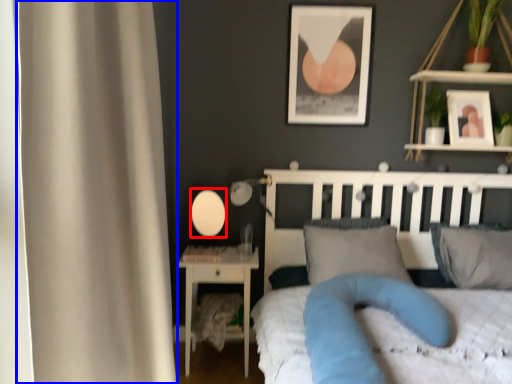
Question: Which point is closer to the camera, oval (highlighted by a red box) or curtain (highlighted by a blue box)?

Choices:
 (A) oval
 (B) curtain

Answer: (B)